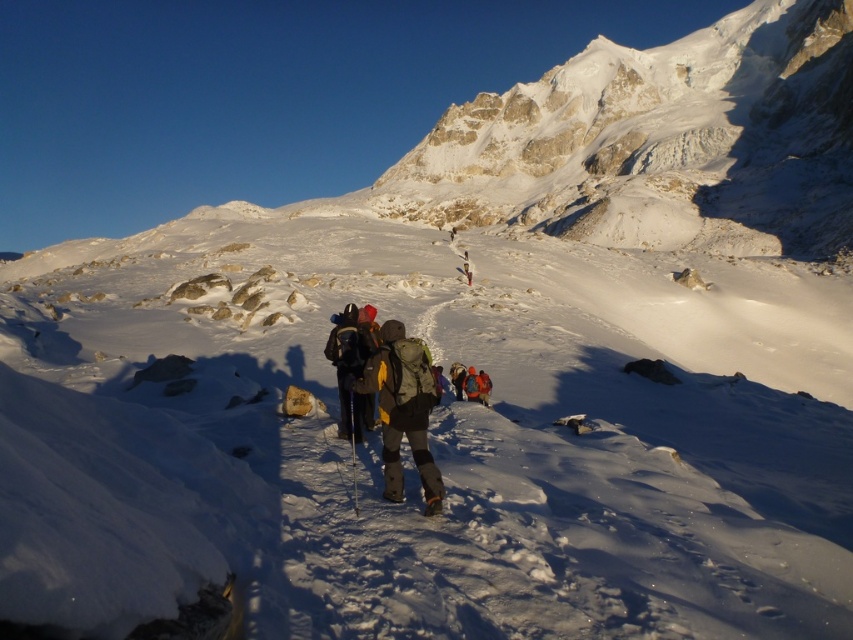
Question: Does matte gray jacket at center appear on the left side of matte black backpack at center?

Choices:
 (A) no
 (B) yes

Answer: (A)

Question: Where is matte gray jacket at center located in relation to matte black backpack at center in the image?

Choices:
 (A) below
 (B) above

Answer: (A)

Question: Which point is farther to the camera?

Choices:
 (A) matte gray jacket at center
 (B) matte black backpack at center

Answer: (B)

Question: Which of the following is the farthest from the observer?

Choices:
 (A) (341, 326)
 (B) (376, 371)

Answer: (A)

Question: Can you confirm if matte gray jacket at center is bigger than matte black backpack at center?

Choices:
 (A) no
 (B) yes

Answer: (A)